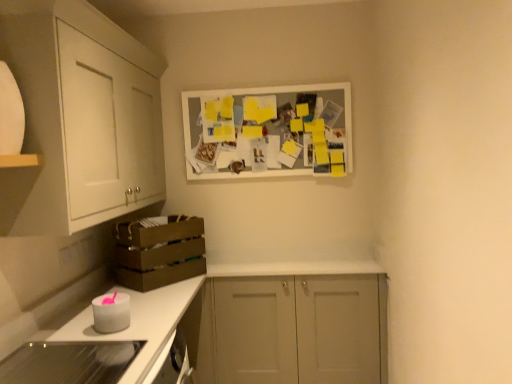
What are the coordinates of `vacant location below white matte picture frame at upper center (from a real-world perspective)` in the screenshot? It's located at (282, 263).